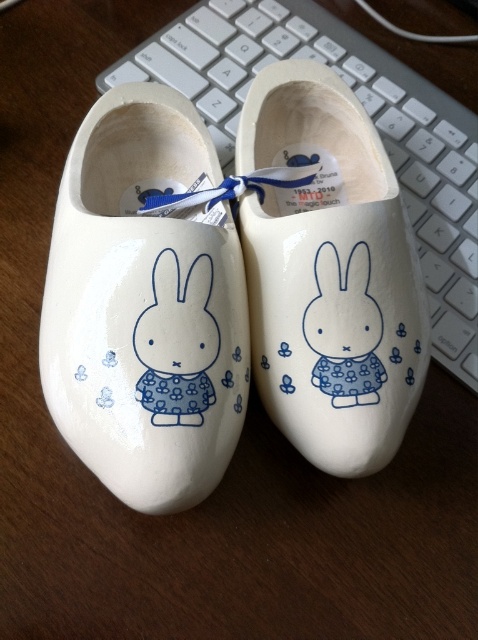
Can you confirm if white glossy wooden shoe at left is positioned above white glossy wooden clog at center?

Actually, white glossy wooden shoe at left is below white glossy wooden clog at center.

Does white glossy wooden shoe at left appear under white glossy wooden clog at center?

Yes.

Is point (90, 138) farther from viewer compared to point (398, 266)?

Yes, it is.

You are a GUI agent. You are given a task and a screenshot of the screen. Output one action in this format:
    pyautogui.click(x=<x>, y=<y>)
    Task: Click on the white glossy wooden shoe at left
    The image size is (478, 640).
    Given the screenshot: What is the action you would take?
    pyautogui.click(x=143, y=307)

Is white glossy wooden clog at center positioned at the back of white plastic keyboard at upper center?

No.

Can you confirm if white glossy wooden clog at center is positioned below white plastic keyboard at upper center?

Correct, white glossy wooden clog at center is located below white plastic keyboard at upper center.

The image size is (478, 640). I want to click on white glossy wooden clog at center, so click(x=329, y=275).

Is white glossy wooden shoe at left above white plastic keyboard at upper center?

No, white glossy wooden shoe at left is not above white plastic keyboard at upper center.

Between point (185, 442) and point (223, 99), which one is positioned in front?

Point (185, 442)

Image resolution: width=478 pixels, height=640 pixels. Find the location of `white glossy wooden shoe at left`. white glossy wooden shoe at left is located at coordinates (143, 307).